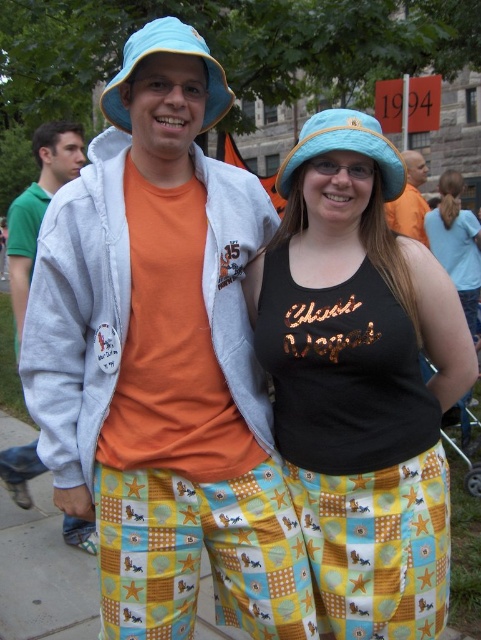
Question: Is matte blue hat at center positioned in front of yellow fabric pants at lower center?

Choices:
 (A) yes
 (B) no

Answer: (A)

Question: Which point is closer to the camera taking this photo?

Choices:
 (A) (23, 561)
 (B) (358, 630)
 (C) (458, 284)
 (D) (25, 241)

Answer: (B)

Question: Which object is the farthest from the matte blue fabric bucket hat at upper center?

Choices:
 (A) matte blue hat at center
 (B) orange cotton shirt at left
 (C) matte black tank top at center
 (D) matte blue fabric hat at center

Answer: (C)

Question: Does matte blue fabric hat at center appear under matte orange t-shirt at center?

Choices:
 (A) no
 (B) yes

Answer: (B)

Question: Which point appears farthest from the camera in this image?

Choices:
 (A) [397, 221]
 (B) [172, 35]
 (C) [455, 262]

Answer: (C)

Question: Is matte blue hat at center closer to camera compared to matte blue fabric bucket hat at upper center?

Choices:
 (A) yes
 (B) no

Answer: (B)